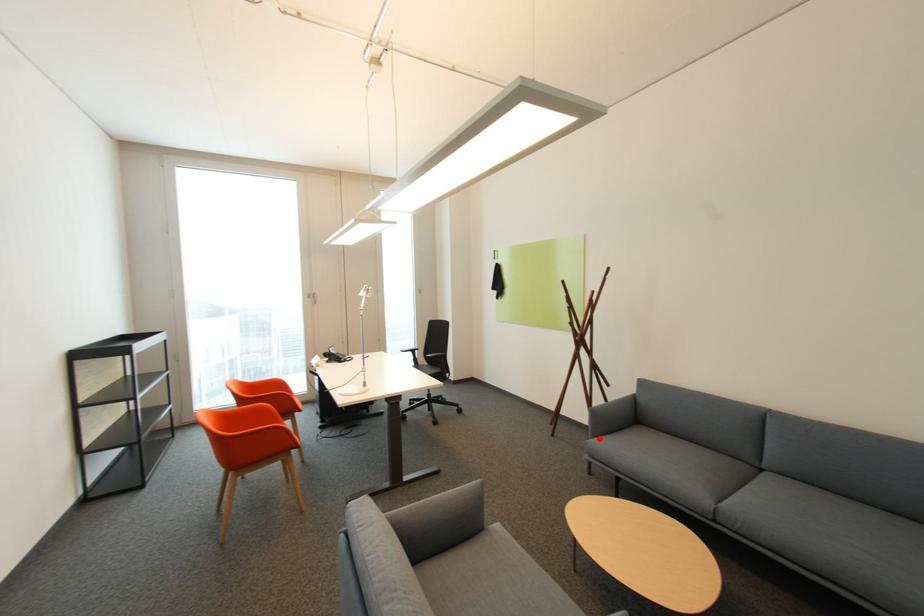
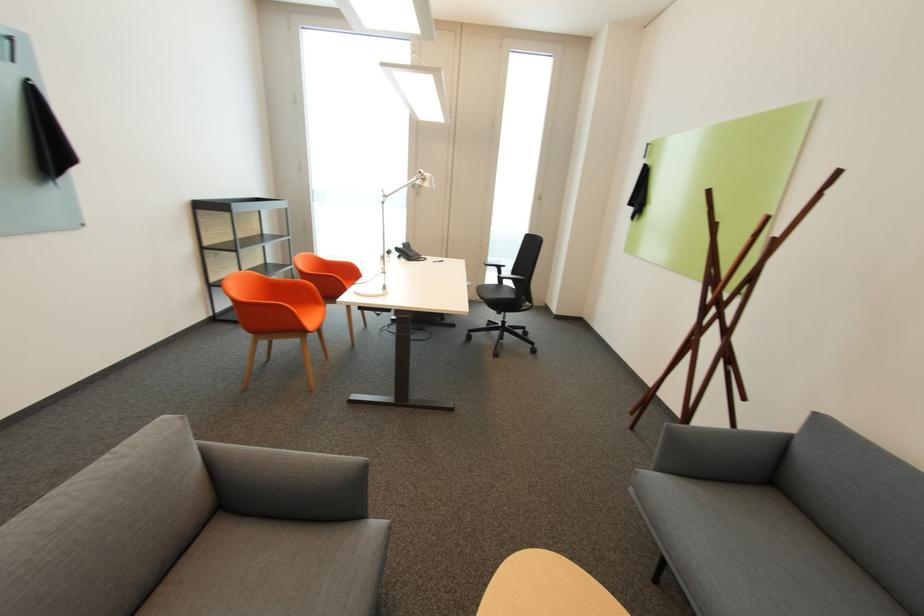
Where in the second image is the point corresponding to the highlighted location from the first image?

(663, 469)